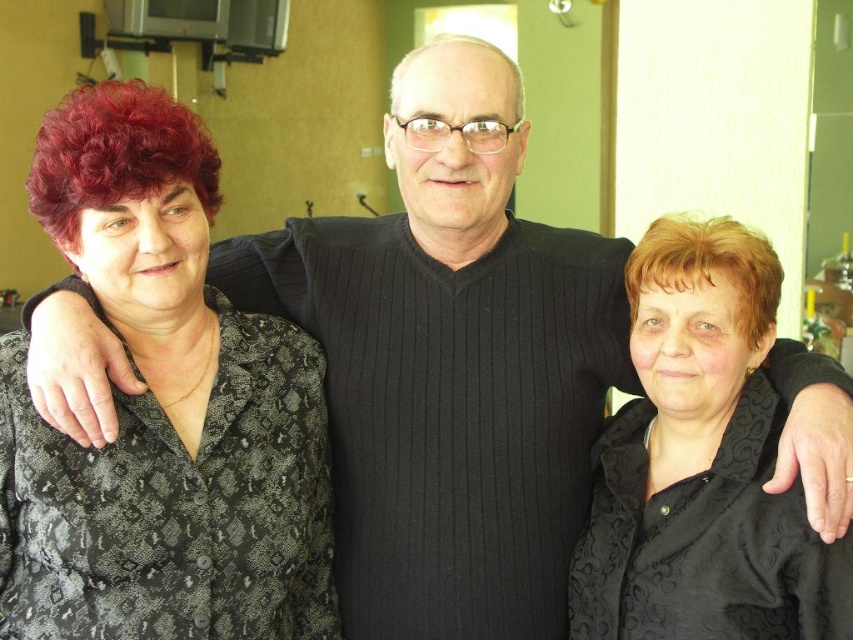
You are a photographer standing at the point marked as point (137, 163). You want to take a photo of the three people standing together. Can you fit all three of them in your camera frame if your camera has a 1.2 meter wide field of view?

The three people are 1.31 meters apart, which is wider than the camera frame of 1.2 meters, so you cannot fit all three of them in the frame.

You are organizing a photoshoot and need to ensure that the black textured blouse at left and the black textured blouse at right are visible in the final image. Based on their positions, which blouse is covering part of the other?

The black textured blouse at left is positioned over the black textured blouse at right, so it is covering part of it.